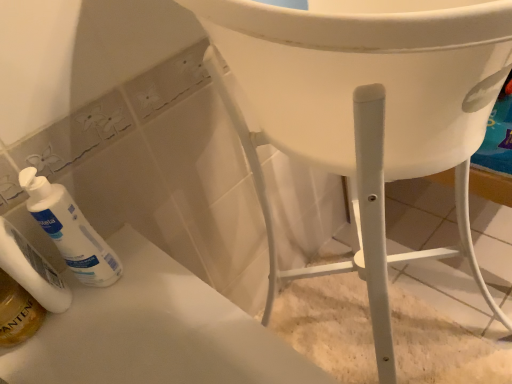
Where is `white matte pump bottle at lower left`? white matte pump bottle at lower left is located at coordinates (70, 231).

Find the location of `white matte lotion at lower left`. white matte lotion at lower left is located at coordinates (32, 270).

Where is `white plastic chair at lower right`? white plastic chair at lower right is located at coordinates (368, 109).

At what (x,y) coordinates should I click in order to perform the action: click on white matte pump bottle at lower left. Please return your answer as a coordinate pair (x, y). Looking at the image, I should click on (70, 231).

Which object is closer to the camera, white plastic chair at lower right or white matte pump bottle at lower left?

white matte pump bottle at lower left is in front.

Can you confirm if white plastic chair at lower right is thinner than white matte pump bottle at lower left?

In fact, white plastic chair at lower right might be wider than white matte pump bottle at lower left.

From a real-world perspective, which object stands above the other?

In real-world perspective, white matte pump bottle at lower left is above.

Does white matte lotion at lower left have a lesser height compared to white plastic chair at lower right?

Incorrect, the height of white matte lotion at lower left does not fall short of that of white plastic chair at lower right.

Can you tell me how much white matte lotion at lower left and white plastic chair at lower right differ in facing direction?

white matte lotion at lower left and white plastic chair at lower right are facing 91.2 degrees away from each other.

Is white matte lotion at lower left aimed at white plastic chair at lower right?

No.

Does white matte lotion at lower left have a larger size compared to white plastic chair at lower right?

No, white matte lotion at lower left is not bigger than white plastic chair at lower right.

Which is less distant, (28, 301) or (250, 65)?

Point (28, 301) is farther from the camera than point (250, 65).

From the image's perspective, is translucent golden mouthwash at lower left located beneath white plastic chair at lower right?

Actually, translucent golden mouthwash at lower left appears above white plastic chair at lower right in the image.

Based on the photo, which object is further away from the camera, translucent golden mouthwash at lower left or white plastic chair at lower right?

white plastic chair at lower right is further away from the camera.

Is translucent golden mouthwash at lower left inside or outside of white plastic chair at lower right?

translucent golden mouthwash at lower left cannot be found inside white plastic chair at lower right.

Considering the positions of objects white matte pump bottle at lower left and white plastic chair at lower right in the image provided, who is more to the left, white matte pump bottle at lower left or white plastic chair at lower right?

white matte pump bottle at lower left is more to the left.

Is white matte pump bottle at lower left with white plastic chair at lower right?

white matte pump bottle at lower left and white plastic chair at lower right are not in contact.

You are a GUI agent. You are given a task and a screenshot of the screen. Output one action in this format:
    pyautogui.click(x=<x>, y=<y>)
    Task: Click on the furniture behind the white matte pump bottle at lower left
    This screenshot has height=384, width=512.
    Given the screenshot: What is the action you would take?
    pyautogui.click(x=368, y=109)

What's the angular difference between white matte pump bottle at lower left and white plastic chair at lower right's facing directions?

white matte pump bottle at lower left and white plastic chair at lower right are facing 91.2 degrees away from each other.

Looking at this image, from a real-world perspective, which is physically below, white matte pump bottle at lower left or white matte lotion at lower left?

white matte pump bottle at lower left is physically lower.

Does white matte pump bottle at lower left have a smaller size compared to white matte lotion at lower left?

Actually, white matte pump bottle at lower left might be larger than white matte lotion at lower left.

Based on the photo, would you say white matte pump bottle at lower left is outside white matte lotion at lower left?

white matte pump bottle at lower left is positioned outside white matte lotion at lower left.

From the image's perspective, does white matte lotion at lower left appear lower than white matte pump bottle at lower left?

Indeed, from the image's perspective, white matte lotion at lower left is shown beneath white matte pump bottle at lower left.

Considering the positions of point (35, 251) and point (58, 233), is point (35, 251) closer or farther from the camera than point (58, 233)?

Point (35, 251).

Considering the sizes of white matte lotion at lower left and white matte pump bottle at lower left in the image, is white matte lotion at lower left bigger or smaller than white matte pump bottle at lower left?

Considering their sizes, white matte lotion at lower left takes up less space than white matte pump bottle at lower left.

Based on the photo, are white plastic chair at lower right and translucent golden mouthwash at lower left making contact?

white plastic chair at lower right is not next to translucent golden mouthwash at lower left, and they're not touching.

From the image's perspective, is white plastic chair at lower right located above or below translucent golden mouthwash at lower left?

white plastic chair at lower right is below translucent golden mouthwash at lower left.

Considering the positions of point (357, 79) and point (27, 309), is point (357, 79) closer or farther from the camera than point (27, 309)?

Point (357, 79) is closer to the camera than point (27, 309).

Between white plastic chair at lower right and translucent golden mouthwash at lower left, which one has less height?

white plastic chair at lower right.

Where is `furniture below the white matte pump bottle at lower left (from the image's perspective)`? The width and height of the screenshot is (512, 384). furniture below the white matte pump bottle at lower left (from the image's perspective) is located at coordinates (368, 109).

Locate an element on the screen. furniture that appears on the right of white matte lotion at lower left is located at coordinates (368, 109).

Which object lies nearer to the anchor point white matte lotion at lower left, white matte pump bottle at lower left or translucent golden mouthwash at lower left?

translucent golden mouthwash at lower left is closer to white matte lotion at lower left.

From the picture: Looking at the image, which one is located further to white plastic chair at lower right, translucent golden mouthwash at lower left or white matte pump bottle at lower left?

Among the two, translucent golden mouthwash at lower left is located further to white plastic chair at lower right.

Which object lies further to the anchor point white matte lotion at lower left, translucent golden mouthwash at lower left or white matte pump bottle at lower left?

white matte pump bottle at lower left is further to white matte lotion at lower left.

Which object lies further to the anchor point white plastic chair at lower right, white matte lotion at lower left or white matte pump bottle at lower left?

Based on the image, white matte lotion at lower left appears to be further to white plastic chair at lower right.

Looking at the image, which one is located further to white matte pump bottle at lower left, white matte lotion at lower left or translucent golden mouthwash at lower left?

Based on the image, translucent golden mouthwash at lower left appears to be further to white matte pump bottle at lower left.

Considering their positions, is translucent golden mouthwash at lower left positioned closer to white matte pump bottle at lower left than white matte lotion at lower left?

white matte lotion at lower left is closer to white matte pump bottle at lower left.

When comparing their distances from white matte pump bottle at lower left, does translucent golden mouthwash at lower left or white plastic chair at lower right seem further?

white plastic chair at lower right is further to white matte pump bottle at lower left.

Based on their spatial positions, is white matte pump bottle at lower left or white matte lotion at lower left closer to translucent golden mouthwash at lower left?

white matte lotion at lower left is closer to translucent golden mouthwash at lower left.

Where is `toiletry between white matte pump bottle at lower left and translucent golden mouthwash at lower left in the up-down direction`? Image resolution: width=512 pixels, height=384 pixels. toiletry between white matte pump bottle at lower left and translucent golden mouthwash at lower left in the up-down direction is located at coordinates (32, 270).

Locate an element on the screen. This screenshot has width=512, height=384. cleaning product between white matte lotion at lower left and white plastic chair at lower right in the horizontal direction is located at coordinates (70, 231).

I want to click on cleaning product located between translucent golden mouthwash at lower left and white plastic chair at lower right in the left-right direction, so click(70, 231).

This screenshot has width=512, height=384. Find the location of `toiletry between translucent golden mouthwash at lower left and white plastic chair at lower right in the horizontal direction`. toiletry between translucent golden mouthwash at lower left and white plastic chair at lower right in the horizontal direction is located at coordinates (32, 270).